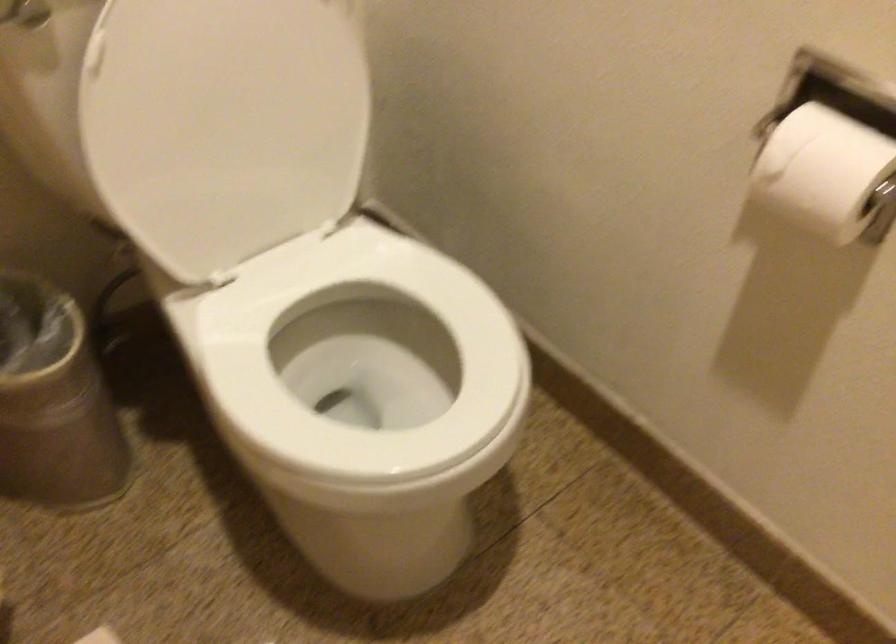
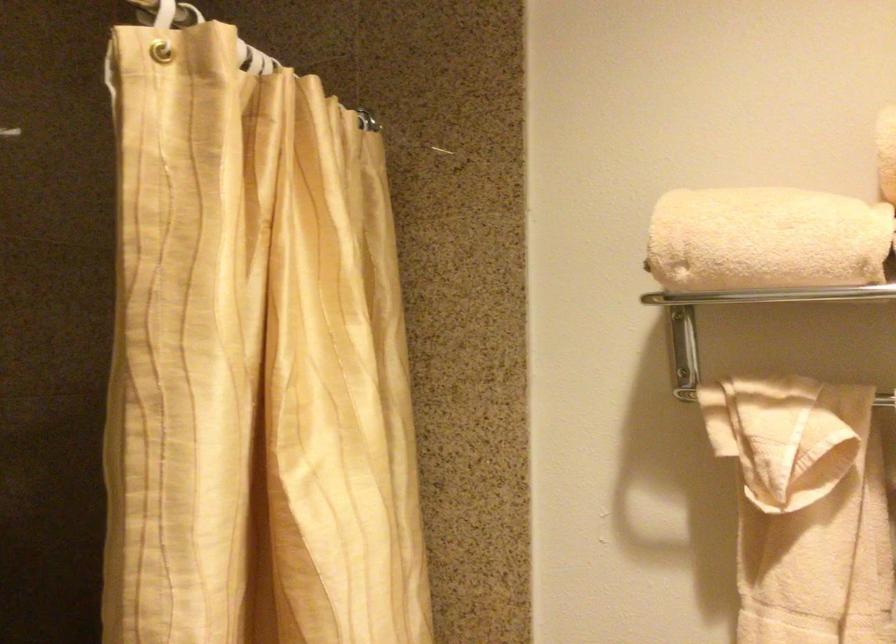
Based on the continuous images, in which direction is the camera rotating?

The rotation direction of the camera is left-up.